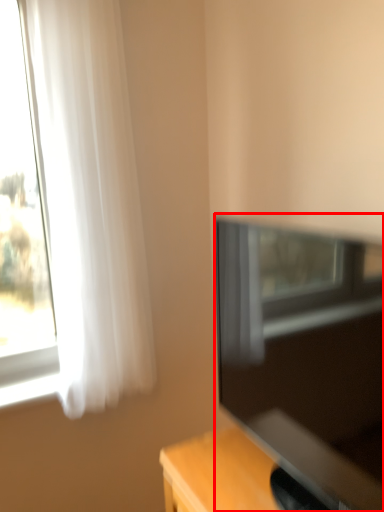
Question: Considering the relative positions of television (annotated by the red box) and curtain in the image provided, where is television (annotated by the red box) located with respect to the staircase?

Choices:
 (A) right
 (B) left

Answer: (A)